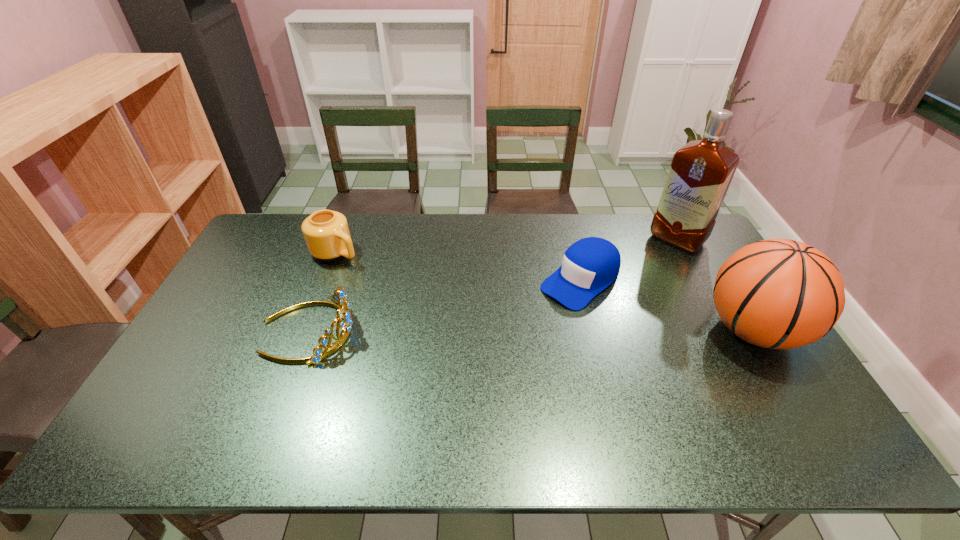
What are the coordinates of `tiara` in the screenshot? It's located at (339, 296).

Image resolution: width=960 pixels, height=540 pixels. In order to click on basketball in this screenshot , I will do `click(782, 294)`.

Where is `baseball cap`? Image resolution: width=960 pixels, height=540 pixels. baseball cap is located at coordinates (591, 264).

Identify the location of the third object from right to left. This screenshot has height=540, width=960. (591, 264).

Locate an element on the screen. liquor is located at coordinates (700, 174).

This screenshot has height=540, width=960. I want to click on mug, so click(x=326, y=233).

Identify the location of vacant space located 0.140m on the front-facing side of the tiara. This screenshot has height=540, width=960. (403, 330).

At what (x,y) coordinates should I click in order to perform the action: click on vacant space located on the back of the fourth shortest object. Please return your answer as a coordinate pair (x, y). This screenshot has width=960, height=540. Looking at the image, I should click on click(692, 228).

What are the coordinates of `vacant space located 0.160m on the front-facing side of the baseball cap` in the screenshot? It's located at (519, 329).

Where is `free space located on the front-facing side of the baseball cap`? free space located on the front-facing side of the baseball cap is located at coordinates pyautogui.click(x=505, y=341).